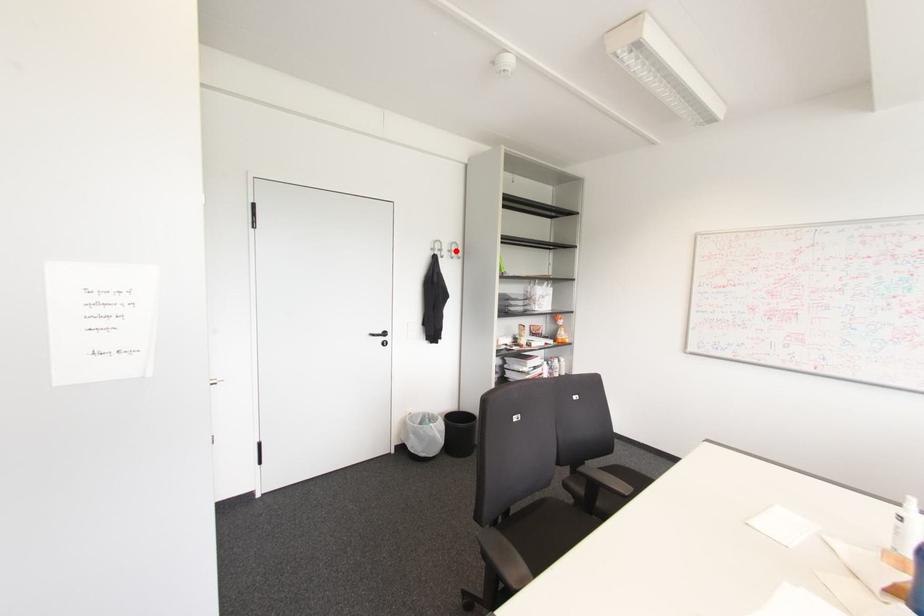
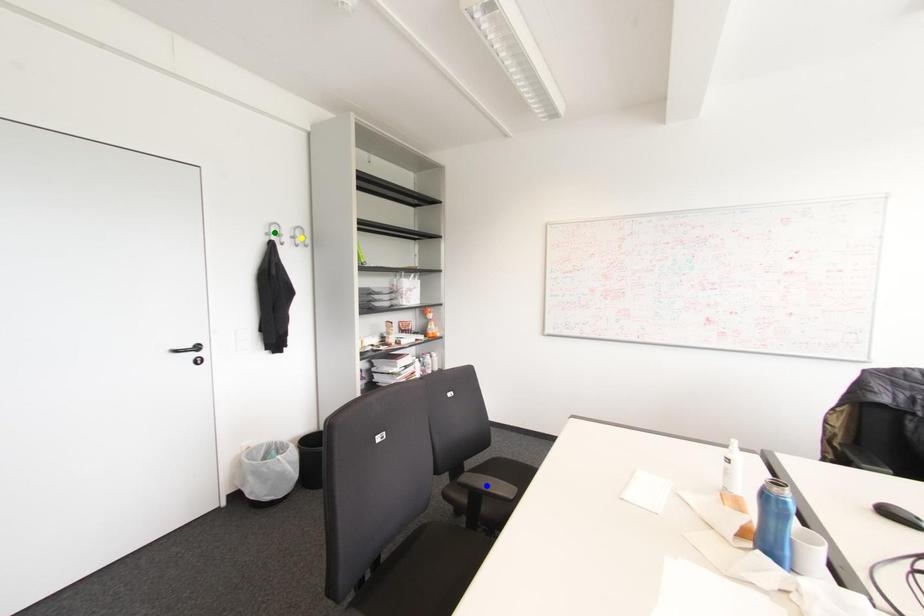
Question: I am providing you with two images of the same scene from different viewpoints. A red point is marked on the first image. You are given multiple points on the second image. In image 2, which mark is for the same physical point as the one in image 1?

Choices:
 (A) green point
 (B) blue point
 (C) yellow point

Answer: (C)